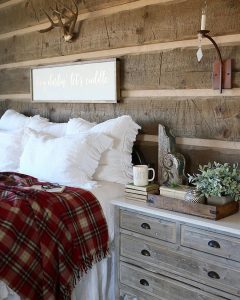
Find the location of a particular element. pillows is located at coordinates (14, 150), (19, 117), (48, 159), (114, 130).